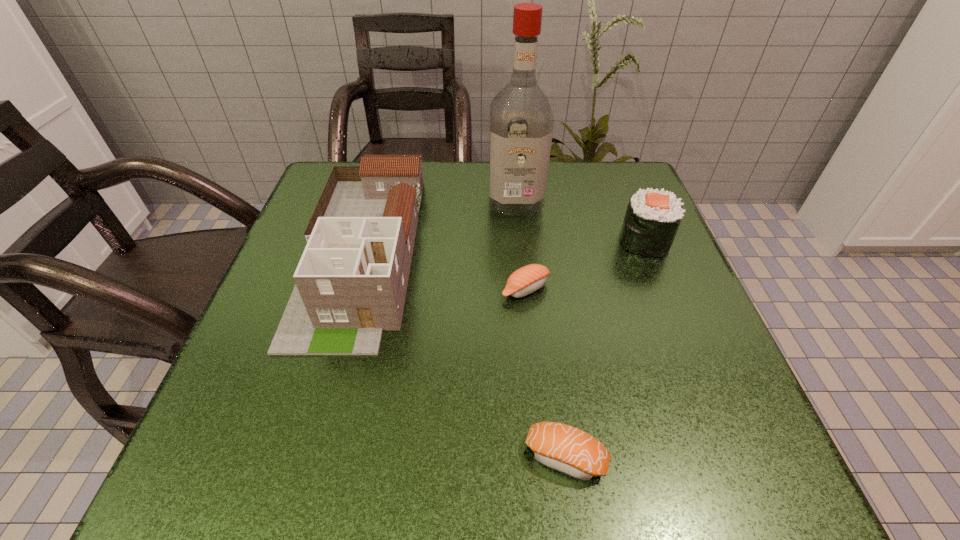
Where is `vacant area located on the left of the second nearest sushi`? Image resolution: width=960 pixels, height=540 pixels. vacant area located on the left of the second nearest sushi is located at coordinates (382, 289).

I want to click on free space located 0.210m on the right of the nearest object, so click(x=756, y=457).

This screenshot has width=960, height=540. Find the location of `liquor that is at the far edge`. liquor that is at the far edge is located at coordinates (521, 121).

The height and width of the screenshot is (540, 960). I want to click on dollhouse at the far edge, so click(x=351, y=281).

You are a GUI agent. You are given a task and a screenshot of the screen. Output one action in this format:
    pyautogui.click(x=<x>, y=<y>)
    Task: Click on the object present at the near edge
    The width and height of the screenshot is (960, 540).
    Given the screenshot: What is the action you would take?
    pyautogui.click(x=564, y=448)

Where is `object present at the left edge`? The height and width of the screenshot is (540, 960). object present at the left edge is located at coordinates (351, 281).

Find the location of `object located at the right edge`. object located at the right edge is located at coordinates (652, 219).

You are a GUI agent. You are given a task and a screenshot of the screen. Output one action in this format:
    pyautogui.click(x=<x>, y=<y>)
    Task: Click on the object located at the far left corner
    This screenshot has height=540, width=960.
    Given the screenshot: What is the action you would take?
    pyautogui.click(x=351, y=281)

Identify the location of free space at the far edge. (470, 202).

You are a GUI agent. You are given a task and a screenshot of the screen. Output one action in this format:
    pyautogui.click(x=<x>, y=<y>)
    Task: Click on the free region at the near edge
    The image size is (960, 540).
    Given the screenshot: What is the action you would take?
    pyautogui.click(x=395, y=435)